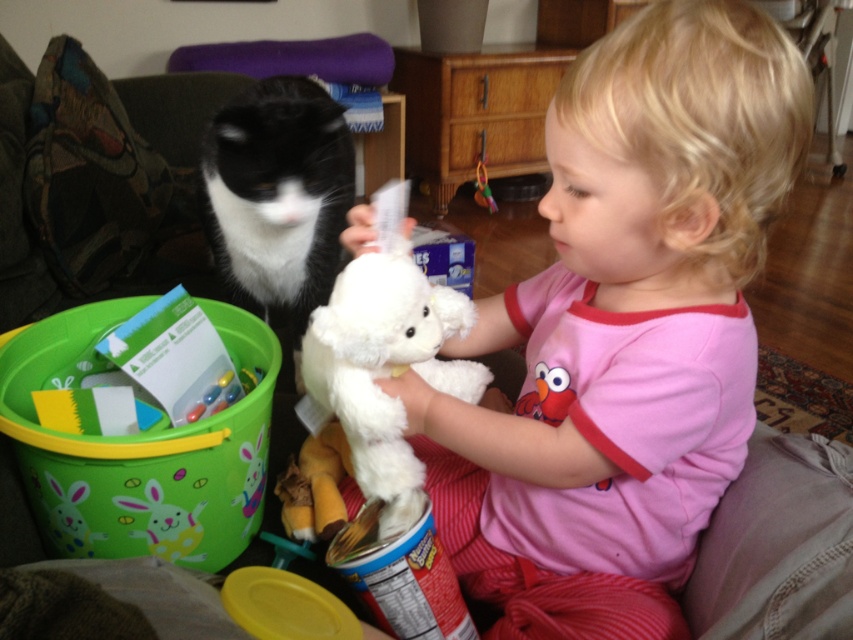
Is white plush toy at center to the left of black and white fur cat at left from the viewer's perspective?

Incorrect, white plush toy at center is not on the left side of black and white fur cat at left.

Is white plush toy at center thinner than black and white fur cat at left?

No.

Between point (706, 289) and point (291, 280), which one is positioned in front?

Positioned in front is point (706, 289).

Image resolution: width=853 pixels, height=640 pixels. Find the location of `white plush toy at center`. white plush toy at center is located at coordinates (624, 330).

Can you confirm if black and white fur cat at left is smaller than white plush at center?

No, black and white fur cat at left is not smaller than white plush at center.

Does point (225, 225) come in front of point (323, 419)?

No, it is behind (323, 419).

In order to click on black and white fur cat at left in this screenshot , I will do `click(277, 196)`.

Does white plush toy at center appear over white plush at center?

Indeed, white plush toy at center is positioned over white plush at center.

Which of these two, white plush toy at center or white plush at center, stands taller?

white plush toy at center is taller.

The image size is (853, 640). Identify the location of white plush toy at center. (624, 330).

This screenshot has width=853, height=640. In order to click on white plush toy at center in this screenshot , I will do `click(624, 330)`.